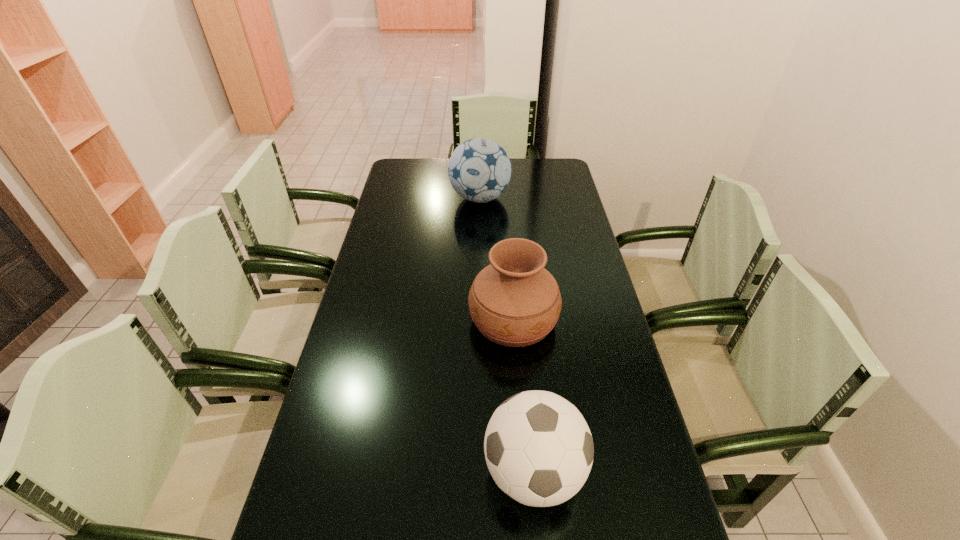
Locate an element on the screen. Image resolution: width=960 pixels, height=540 pixels. vacant space that satisfies the following two spatial constraints: 1. on the side with brand of the farthest object; 2. on the right side of the nearer soccer ball is located at coordinates (480, 471).

Find the location of `vacant space that satisfies the following two spatial constraints: 1. on the front side of the urn; 2. on the right side of the nearer soccer ball`. vacant space that satisfies the following two spatial constraints: 1. on the front side of the urn; 2. on the right side of the nearer soccer ball is located at coordinates (525, 471).

Locate an element on the screen. This screenshot has height=540, width=960. vacant point that satisfies the following two spatial constraints: 1. on the side with brand of the farther soccer ball; 2. on the left side of the nearer soccer ball is located at coordinates (480, 471).

Image resolution: width=960 pixels, height=540 pixels. I want to click on free space that satisfies the following two spatial constraints: 1. on the side with brand of the nearer soccer ball; 2. on the right side of the farther soccer ball, so click(480, 471).

Identify the location of free space in the image that satisfies the following two spatial constraints: 1. on the side with brand of the nearer soccer ball; 2. on the left side of the farthest object. This screenshot has width=960, height=540. (480, 471).